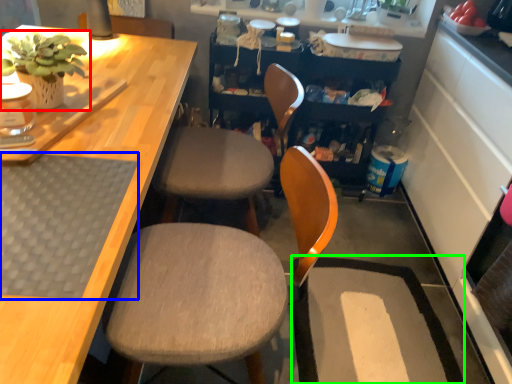
Question: Based on their relative distances, which object is farther from houseplant (highlighted by a red box)? Choose from mat (highlighted by a blue box) and wide (highlighted by a green box).

Choices:
 (A) mat
 (B) wide

Answer: (B)